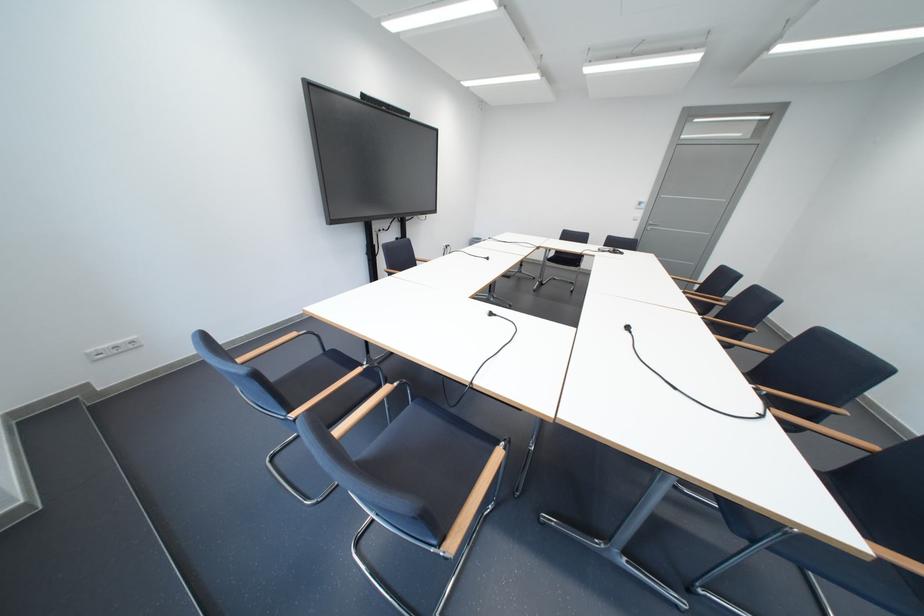
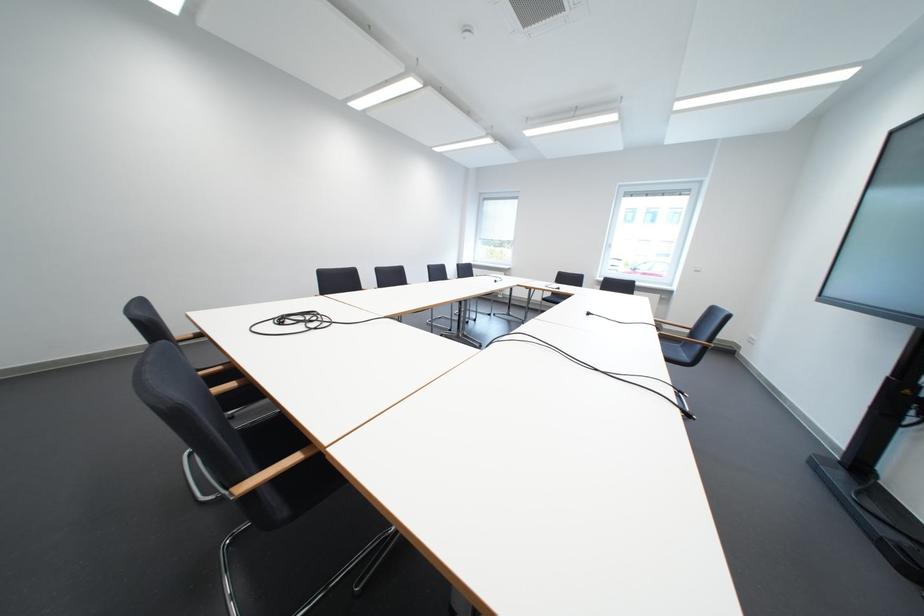
Find the pixel in the second image that matches point (500, 261) in the first image.

(601, 315)